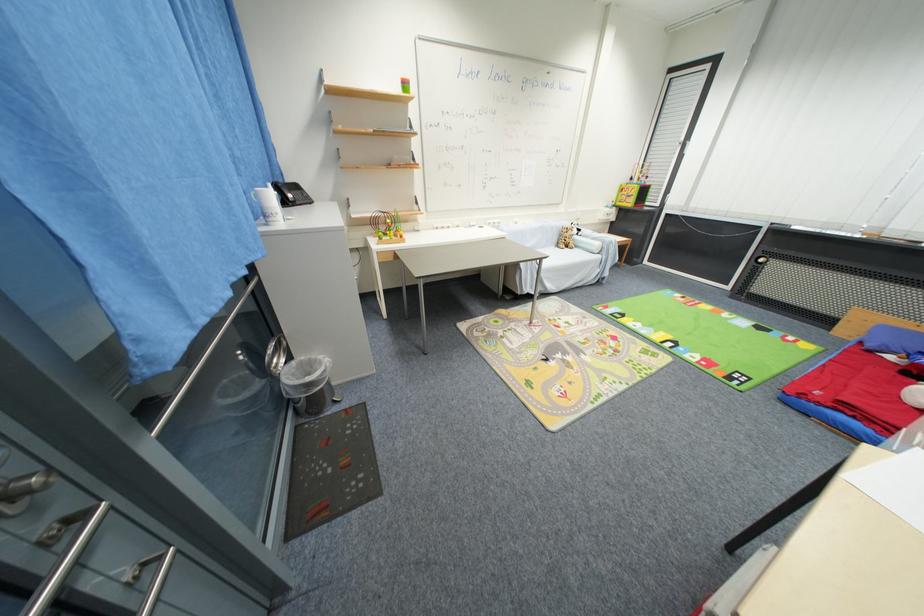
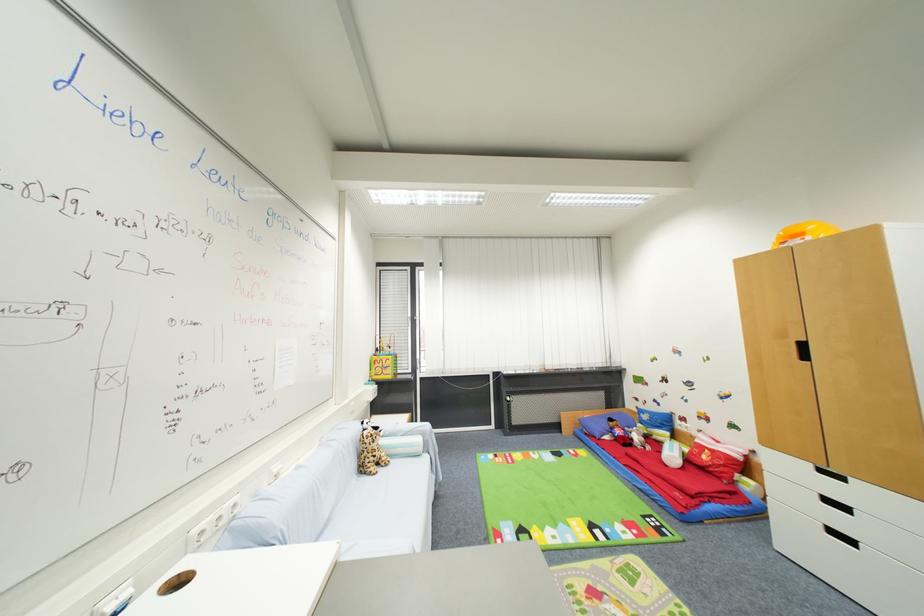
Find the pixel in the second image that matches [563,246] in the first image.

(367, 472)